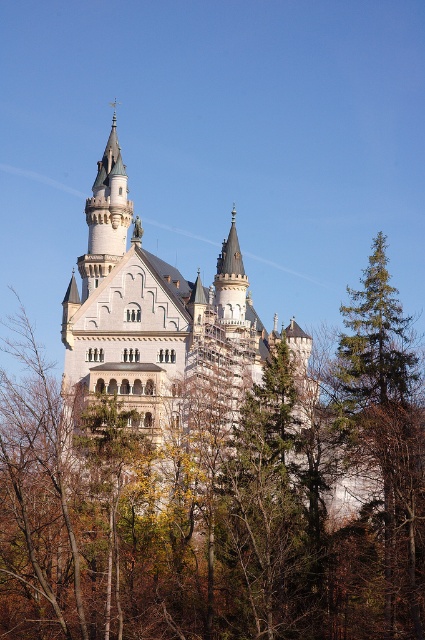
You are a visitor standing in front of the white stone castle at center and the white stone tower at upper center. Which structure is closer to you?

The white stone castle at center is closer to you because it is in front of the white stone tower at upper center.

You are standing in a field and see the white stone castle at center. If you want to take a photo of the castle with the main tower and its green conical roof clearly visible, which direction should you face?

The white stone castle at center is located at point (155, 314), so you should face towards the center of the image to capture the main tower and its green conical roof clearly.